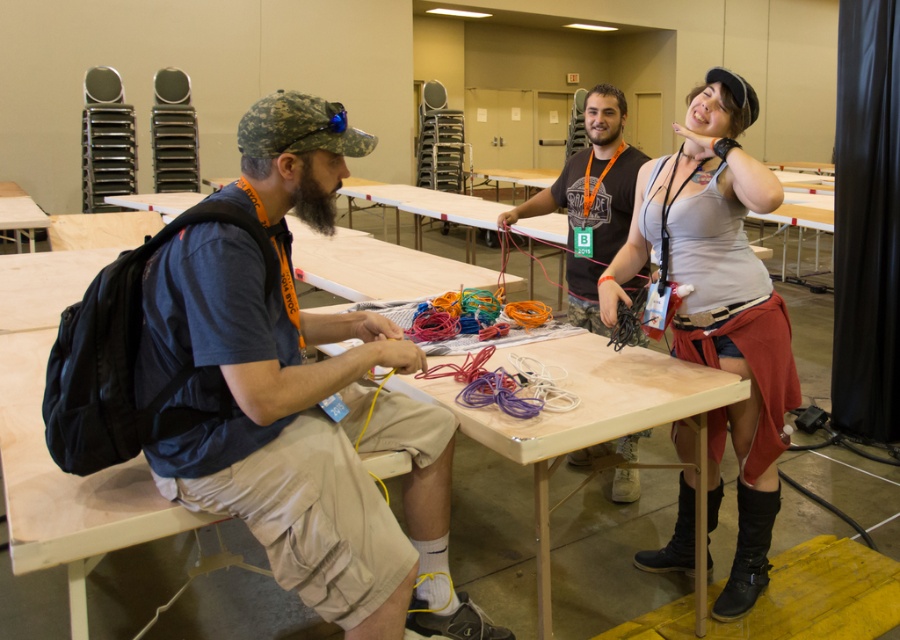
Question: Is wooden table at center to the right of camouflage tank top at center from the viewer's perspective?

Choices:
 (A) no
 (B) yes

Answer: (A)

Question: Which object appears closest to the camera in this image?

Choices:
 (A) wooden table at center
 (B) camouflage tank top at center
 (C) gray fabric tank top at upper right
 (D) matte blue shirt at left

Answer: (D)

Question: Is the position of matte blue shirt at left more distant than that of camouflage tank top at center?

Choices:
 (A) no
 (B) yes

Answer: (A)

Question: Which object is positioned farthest from the matte blue shirt at left?

Choices:
 (A) gray fabric tank top at upper right
 (B) camouflage tank top at center

Answer: (B)

Question: Which of the following is the closest to the observer?

Choices:
 (A) (310, 316)
 (B) (623, 484)
 (C) (637, 400)
 (D) (750, 406)

Answer: (C)

Question: Observing the image, what is the correct spatial positioning of matte blue shirt at left in reference to gray fabric tank top at upper right?

Choices:
 (A) left
 (B) right

Answer: (A)